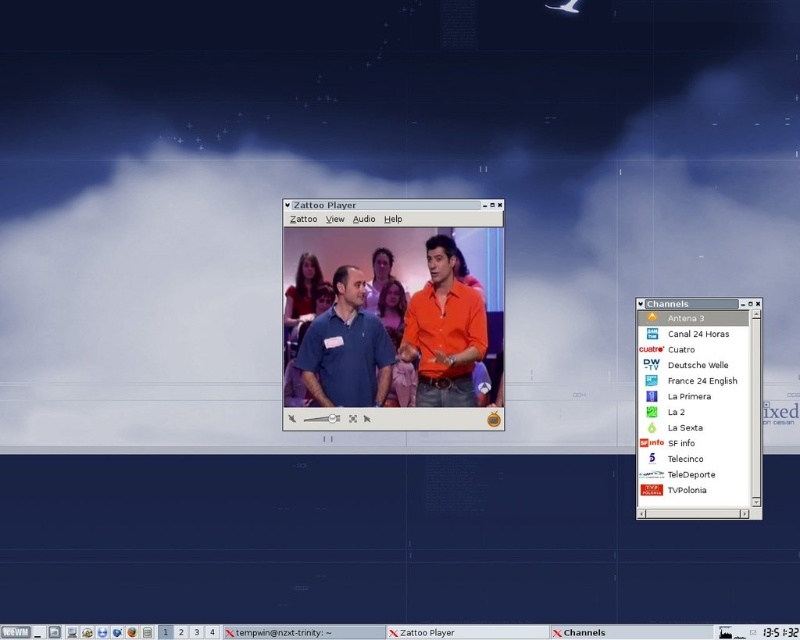
Question: Does matte plastic channels list at right appear under transparent text at bottom?

Choices:
 (A) yes
 (B) no

Answer: (B)

Question: Which is farther from the black matte zattoo player at bottom?

Choices:
 (A) transparent text at bottom
 (B) matte orange shirt at center

Answer: (B)

Question: Which object is the closest to the matte blue shirt at center?

Choices:
 (A) black matte zattoo player at bottom
 (B) transparent text at bottom

Answer: (B)

Question: Can you confirm if orange matte shirt at center is smaller than matte blue shirt at center?

Choices:
 (A) yes
 (B) no

Answer: (B)

Question: Is matte blue shirt at center below transparent text at bottom?

Choices:
 (A) yes
 (B) no

Answer: (B)

Question: Considering the real-world distances, which object is farthest from the orange matte shirt at center?

Choices:
 (A) matte plastic channels list at right
 (B) transparent text at bottom

Answer: (B)